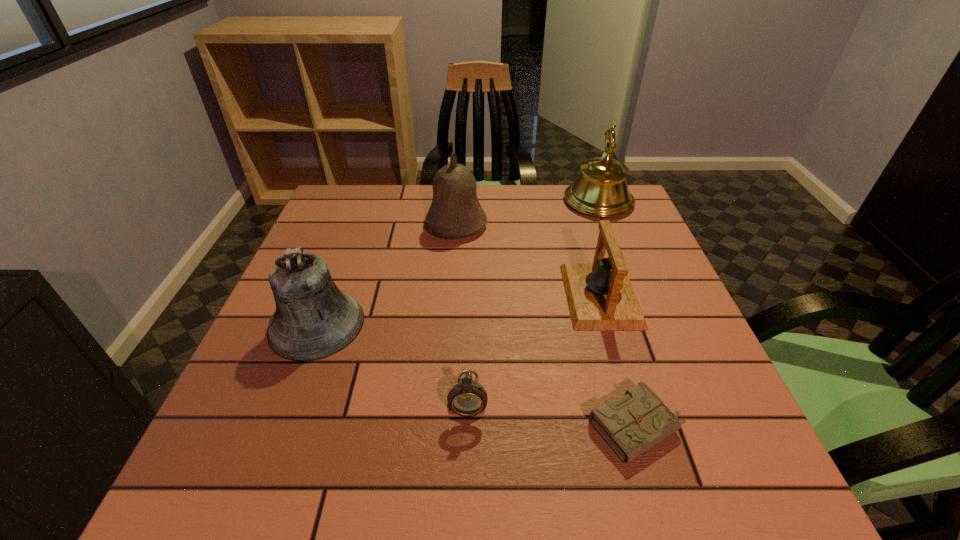
Point out which bell is positioned as the fourth nearest to the fifth tallest object. Please provide its 2D coordinates. Your answer should be formatted as a tuple, i.e. [(x, y)], where the tuple contains the x and y coordinates of a point satisfying the conditions above.

[(601, 189)]

You are a GUI agent. You are given a task and a screenshot of the screen. Output one action in this format:
    pyautogui.click(x=<x>, y=<y>)
    Task: Click on the vacant region that satisfies the following two spatial constraints: 1. on the face of the fifth tallest object; 2. on the right side of the shortest object
    This screenshot has width=960, height=540.
    Given the screenshot: What is the action you would take?
    pyautogui.click(x=468, y=427)

Locate an element on the screen. free space that satisfies the following two spatial constraints: 1. on the front side of the shortest bell; 2. on the left side of the third bell from right to left is located at coordinates (451, 296).